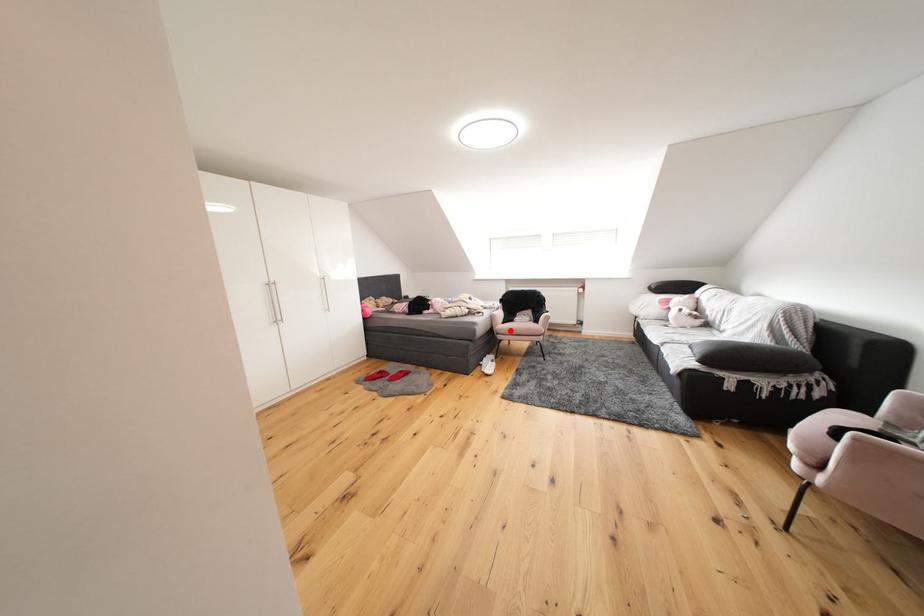
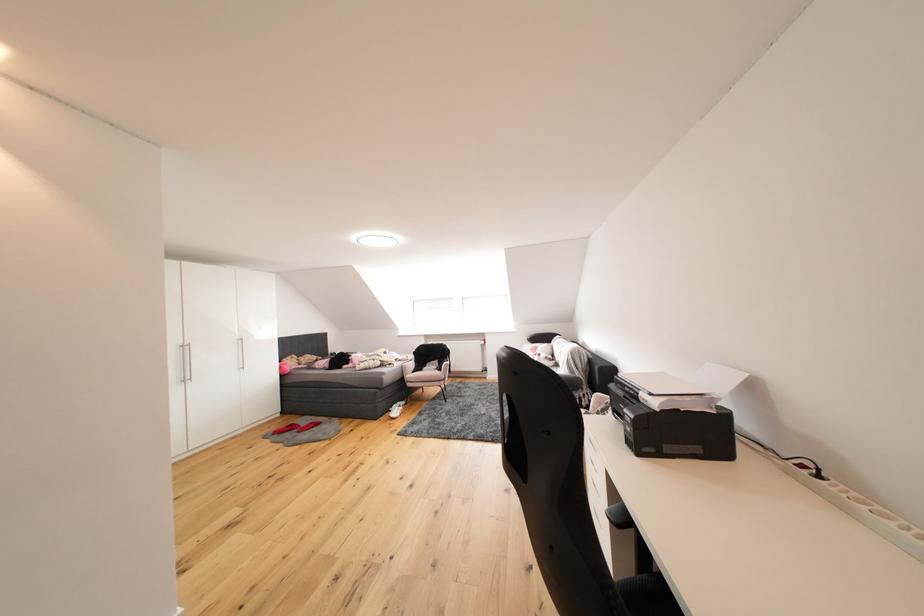
Question: I am providing you with two images of the same scene from different viewpoints. Image1 has a red point marked. In image2, the corresponding 3D location appears at what relative position? Reply with the corresponding letter.

Choices:
 (A) Closer
 (B) Farther

Answer: (B)